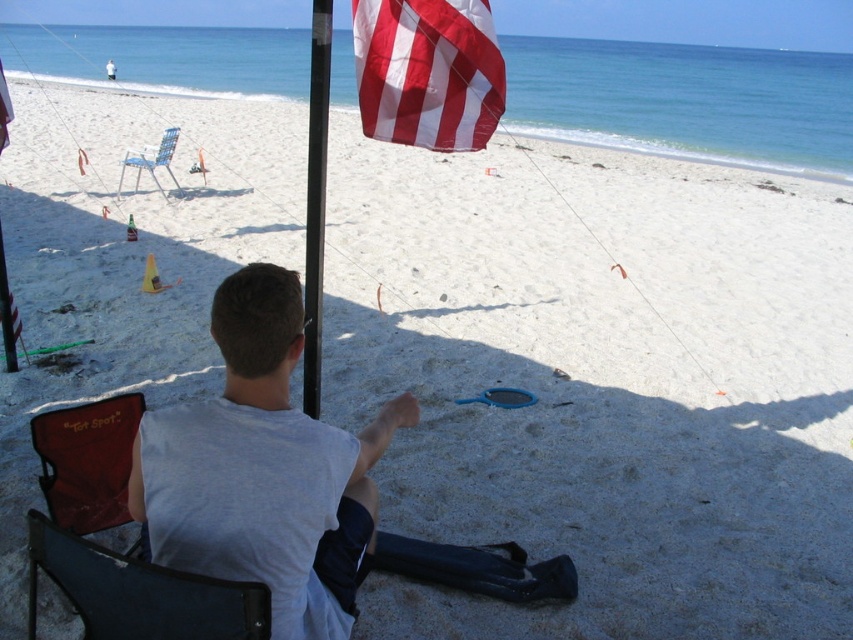
Between dark gray fabric chair at lower left and maroon fabric chair at lower left, which one appears on the left side from the viewer's perspective?

maroon fabric chair at lower left is more to the left.

Locate an element on the screen. This screenshot has height=640, width=853. dark gray fabric chair at lower left is located at coordinates (138, 593).

Who is more distant from viewer, (462, 125) or (62, 467)?

Point (462, 125)

Can you confirm if red/white striped fabric at upper center is thinner than maroon fabric chair at lower left?

Yes, red/white striped fabric at upper center is thinner than maroon fabric chair at lower left.

What do you see at coordinates (427, 72) in the screenshot? The height and width of the screenshot is (640, 853). I see `red/white striped fabric at upper center` at bounding box center [427, 72].

This screenshot has height=640, width=853. I want to click on red/white striped fabric at upper center, so click(427, 72).

Is point (384, 51) less distant than point (122, 180)?

Yes, it is.

Does red/white striped fabric at upper center lie in front of metallic blue chair at upper left?

Yes, it is.

Describe the element at coordinates (427, 72) in the screenshot. I see `red/white striped fabric at upper center` at that location.

The height and width of the screenshot is (640, 853). Find the location of `red/white striped fabric at upper center`. red/white striped fabric at upper center is located at coordinates (427, 72).